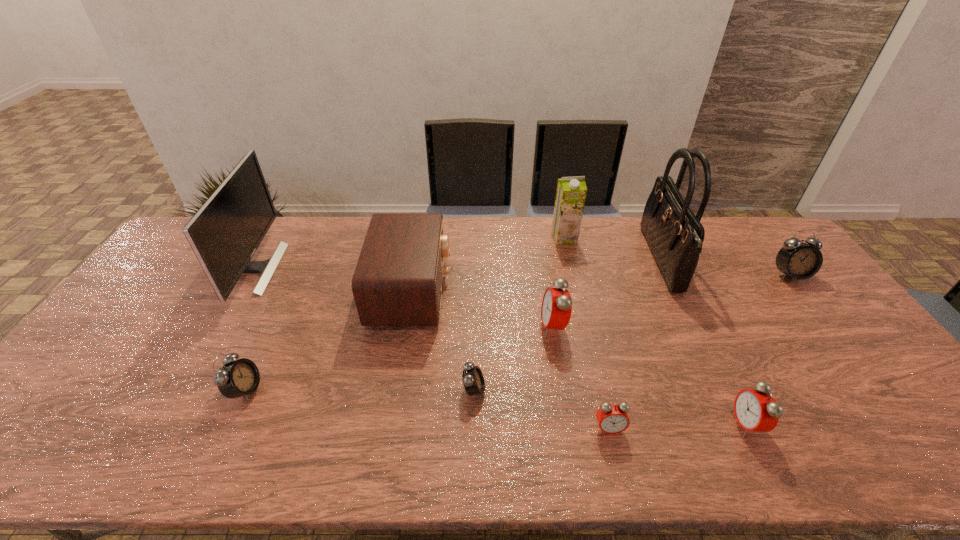
Find the location of a particular element. This screenshot has width=960, height=540. free point located on the face of the leftmost white alarm clock is located at coordinates (304, 390).

You are a GUI agent. You are given a task and a screenshot of the screen. Output one action in this format:
    pyautogui.click(x=<x>, y=<y>)
    Task: Click on the free space located on the front-facing side of the rightmost red alarm clock
    
    Given the screenshot: What is the action you would take?
    pyautogui.click(x=575, y=424)

You are a GUI agent. You are given a task and a screenshot of the screen. Output one action in this format:
    pyautogui.click(x=<x>, y=<y>)
    Task: Click on the blank area located 0.210m on the front-facing side of the rightmost red alarm clock
    Image resolution: width=960 pixels, height=540 pixels.
    Given the screenshot: What is the action you would take?
    pyautogui.click(x=644, y=424)

The image size is (960, 540). Identify the location of free space located on the front-facing side of the rightmost red alarm clock. tap(683, 424).

Where is `vacant point located 0.210m on the face of the smallest white alarm clock`? vacant point located 0.210m on the face of the smallest white alarm clock is located at coordinates (569, 389).

Locate an element on the screen. The image size is (960, 540). handbag that is positioned at the far edge is located at coordinates (675, 235).

Where is `monitor present at the far edge`? Image resolution: width=960 pixels, height=540 pixels. monitor present at the far edge is located at coordinates (224, 234).

This screenshot has height=540, width=960. In order to click on soya milk situated at the far edge in this screenshot , I will do `click(571, 192)`.

The height and width of the screenshot is (540, 960). Identify the location of radio receiver that is at the far edge. (398, 278).

Where is `object at the right edge`? The image size is (960, 540). object at the right edge is located at coordinates (796, 259).